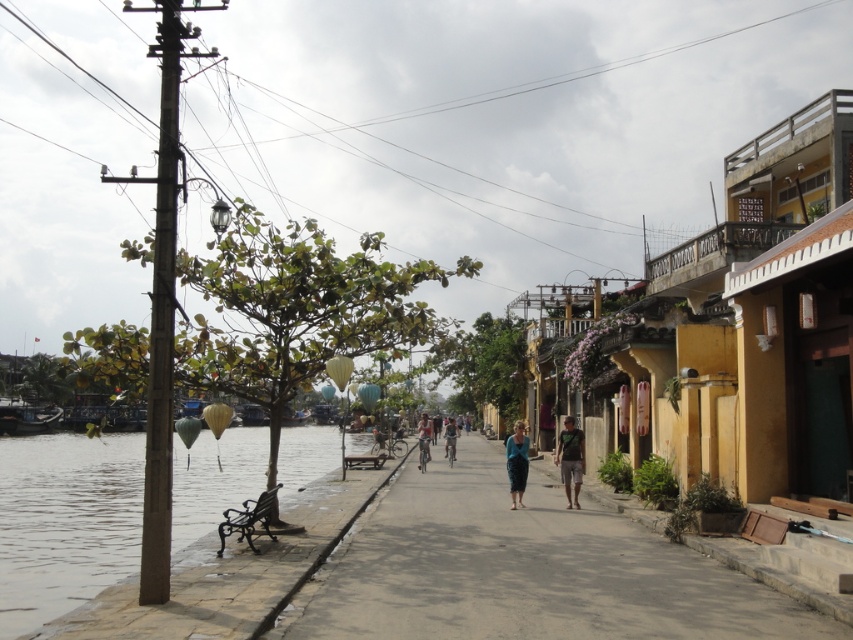
You are standing at the riverside and looking at the scene. There is a point marked at coordinates point [570,460]. What object is this point located on?

The point [570,460] is located on the green fabric shirt at center.

You are a tourist visiting the riverside area and want to take a photo of the green fabric shirt at center while sitting on the wooden bench under the tree. Is the bench positioned in a way that allows you to see the shirt clearly?

The green fabric shirt at center is located at point (570, 460), which means it is positioned in the lower right part of the scene. Since the wooden bench is under the tree on the riverbank, which is on the left side, the bench is on the opposite side of the shirt. Therefore, sitting on the bench would allow you to see the shirt clearly as it is in the center of the scene.